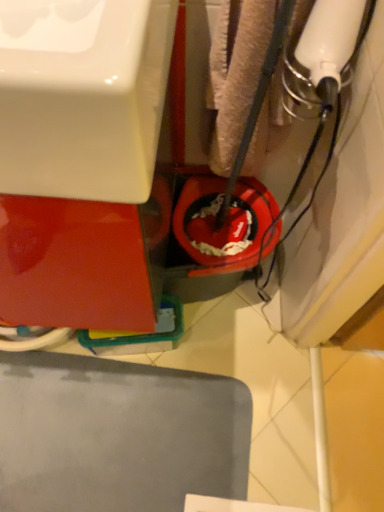
Describe the element at coordinates (83, 96) in the screenshot. Image resolution: width=384 pixels, height=512 pixels. I see `white glossy sink at lower left` at that location.

Where is `white glossy sink at lower left`? The image size is (384, 512). white glossy sink at lower left is located at coordinates coord(83,96).

The width and height of the screenshot is (384, 512). I want to click on white glossy sink at lower left, so click(x=83, y=96).